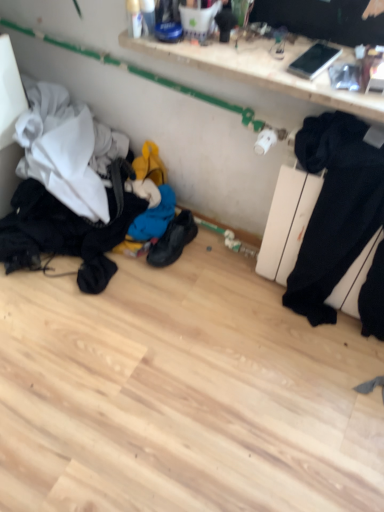
Question: Based on their sizes in the image, would you say white glossy shelf at upper center is bigger or smaller than black fabric laundry at lower left?

Choices:
 (A) small
 (B) big

Answer: (A)

Question: Does point (304, 94) appear closer or farther from the camera than point (61, 225)?

Choices:
 (A) closer
 (B) farther

Answer: (A)

Question: Estimate the real-world distances between objects in this image. Which object is closer to the black matte sweat pants at right?

Choices:
 (A) black leather shoes at center
 (B) white glossy shelf at upper center
 (C) black fabric laundry at lower left

Answer: (B)

Question: Estimate the real-world distances between objects in this image. Which object is farther from the black fabric laundry at lower left?

Choices:
 (A) white glossy shelf at upper center
 (B) black leather shoes at center
 (C) black matte sweat pants at right

Answer: (C)